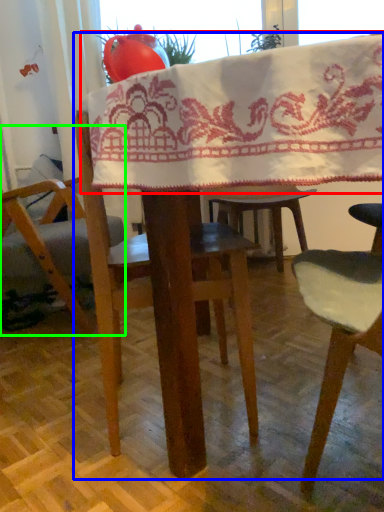
Question: Which is nearer to the blanket (highlighted by a red box)? table (highlighted by a blue box) or chair (highlighted by a green box).

Choices:
 (A) table
 (B) chair

Answer: (A)